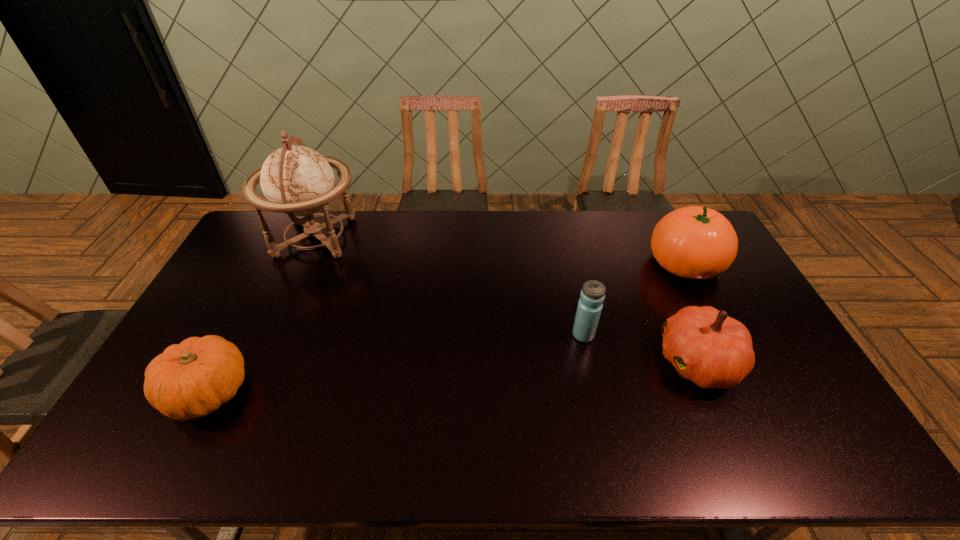
Locate an element on the screen. the tallest object is located at coordinates (296, 180).

The height and width of the screenshot is (540, 960). Find the location of `the farthest pumpkin`. the farthest pumpkin is located at coordinates (694, 242).

This screenshot has height=540, width=960. I want to click on the third object from right to left, so click(590, 304).

Where is `the leftmost pumpkin`? the leftmost pumpkin is located at coordinates (192, 379).

This screenshot has height=540, width=960. In order to click on the shortest pumpkin in this screenshot , I will do coord(192,379).

Where is `free space located at the front of the tallest object showing Africa`? The height and width of the screenshot is (540, 960). free space located at the front of the tallest object showing Africa is located at coordinates (458, 237).

Where is `blank space located 0.390m on the front of the farthest pumpkin`? This screenshot has width=960, height=540. blank space located 0.390m on the front of the farthest pumpkin is located at coordinates (752, 393).

I want to click on free space located 0.400m on the left of the third object from right to left, so tap(439, 335).

Identify the location of blank area located on the right of the leftmost pumpkin. The image size is (960, 540). (348, 392).

You are a GUI agent. You are given a task and a screenshot of the screen. Output one action in this format:
    pyautogui.click(x=<x>, y=<y>)
    Task: Click on the globe that is at the far edge
    The height and width of the screenshot is (540, 960).
    Given the screenshot: What is the action you would take?
    pyautogui.click(x=296, y=180)